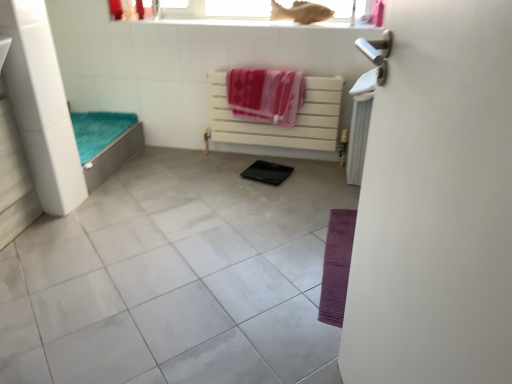
Locate an element on the screen. free space in front of white plastic radiator at center is located at coordinates click(x=264, y=199).